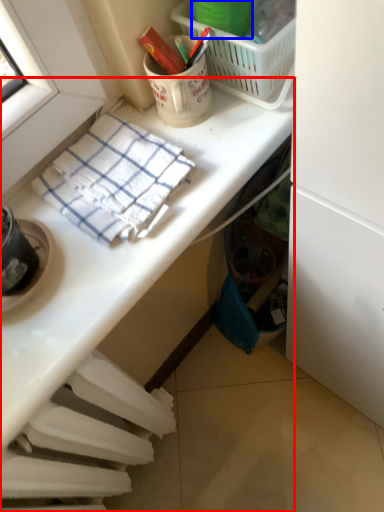
Question: Which object is closer to the camera taking this photo, desk (highlighted by a red box) or bucket (highlighted by a blue box)?

Choices:
 (A) desk
 (B) bucket

Answer: (A)